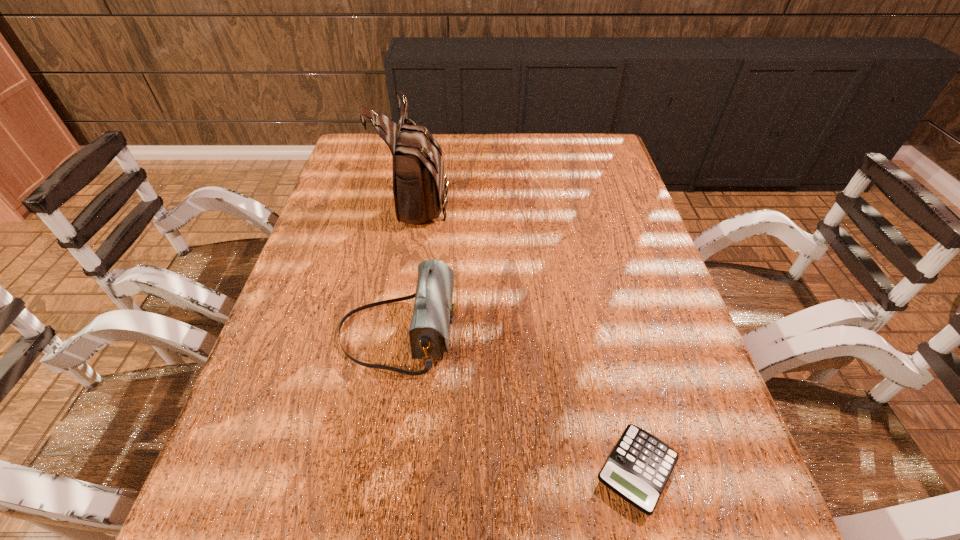
Image resolution: width=960 pixels, height=540 pixels. In order to click on the tallest object in this screenshot , I will do `click(419, 187)`.

At what (x,y) coordinates should I click in order to perform the action: click on the taller shoulder bag. Please return your answer as a coordinate pair (x, y). Image resolution: width=960 pixels, height=540 pixels. Looking at the image, I should click on (419, 187).

Where is `the second nearest object`? The image size is (960, 540). the second nearest object is located at coordinates (433, 312).

You are a GUI agent. You are given a task and a screenshot of the screen. Output one action in this format:
    pyautogui.click(x=<x>, y=<y>)
    Task: Click on the shorter shoulder bag
    This screenshot has height=540, width=960.
    Given the screenshot: What is the action you would take?
    pyautogui.click(x=433, y=312)

You are a GUI agent. You are given a task and a screenshot of the screen. Output one action in this format:
    pyautogui.click(x=<x>, y=<y>)
    Task: Click on the nearest object
    The image size is (960, 540).
    Given the screenshot: What is the action you would take?
    pyautogui.click(x=638, y=468)

At what (x,y) coordinates should I click in order to perform the action: click on the rightmost object. Please return your answer as a coordinate pair (x, y). Looking at the image, I should click on (638, 468).

Locate an element on the screen. This screenshot has width=960, height=540. free space located 0.190m on the front-facing side of the farther shoulder bag is located at coordinates (515, 199).

Image resolution: width=960 pixels, height=540 pixels. I want to click on free space located on the right of the second shortest object, so click(x=484, y=333).

Find the location of a particular element. This screenshot has height=540, width=960. free space located 0.200m on the left of the calculator is located at coordinates (476, 470).

Where is `object that is positioned at the near edge`? The image size is (960, 540). object that is positioned at the near edge is located at coordinates (638, 468).